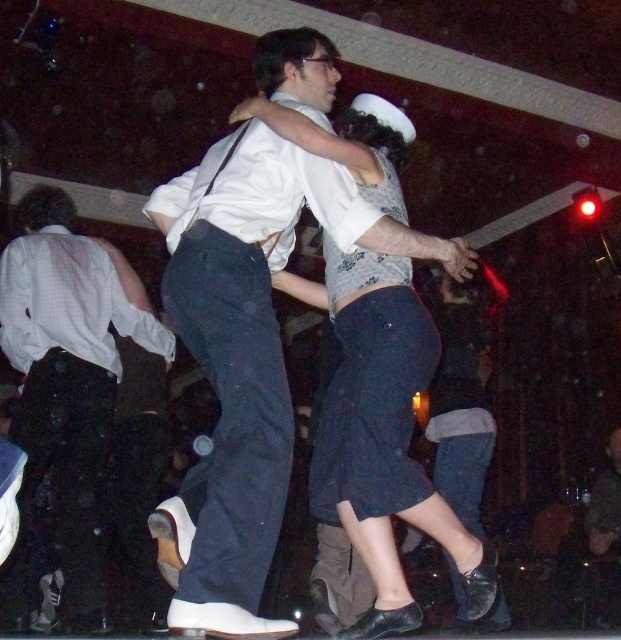
You are at a party and want to take a photo of the white matte shirt at center and the matte black pants at center. Which one will appear larger in your photo?

The white matte shirt at center will appear larger in the photo because it is closer to the viewer than the matte black pants at center.